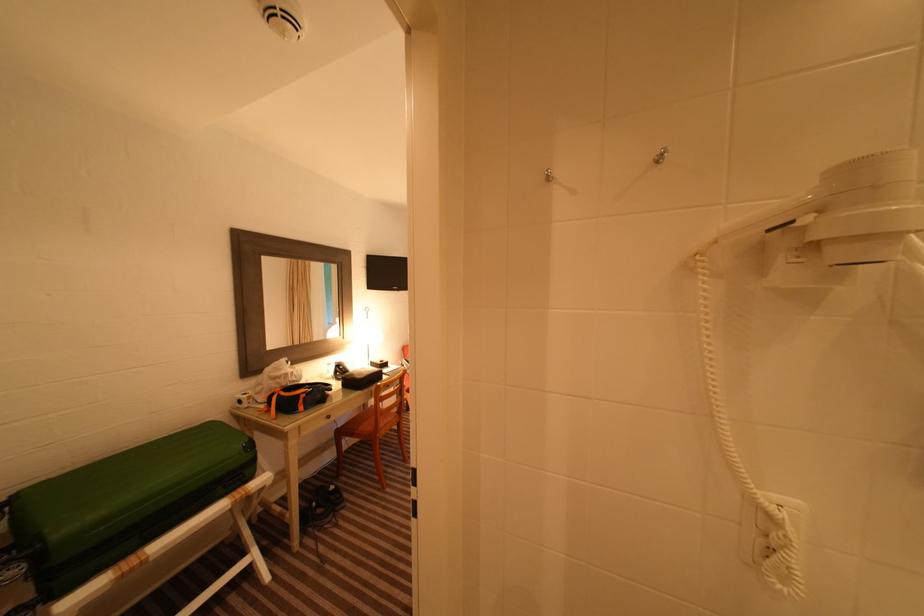
The image size is (924, 616). I want to click on lamp switch, so click(x=772, y=531).